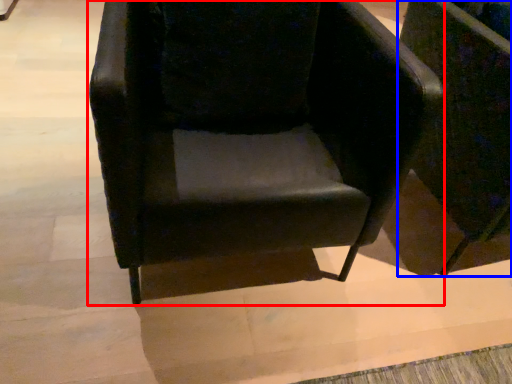
Question: Which of the following is the closest to the observer, chair (highlighted by a red box) or chair (highlighted by a blue box)?

Choices:
 (A) chair
 (B) chair

Answer: (A)